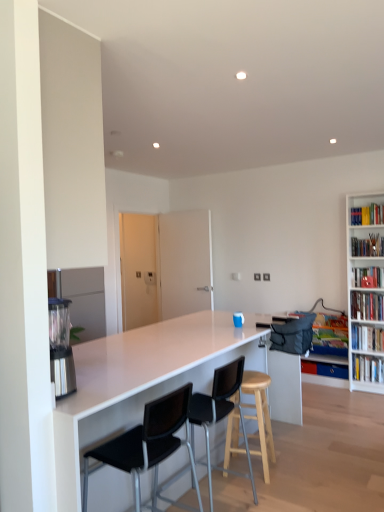
Question: Is white matte bookshelf at right, acting as the 4th book starting from the top, located within hardcover book at upper right, which is the 1th book in top-to-bottom order?

Choices:
 (A) yes
 (B) no

Answer: (B)

Question: Can you confirm if hardcover book at upper right, which is the 1th book in top-to-bottom order, is thinner than white matte bookshelf at right, acting as the 4th book starting from the top?

Choices:
 (A) no
 (B) yes

Answer: (B)

Question: Does hardcover book at upper right, the 7th book in the bottom-to-top sequence, turn towards white matte bookshelf at right, acting as the 4th book starting from the top?

Choices:
 (A) yes
 (B) no

Answer: (B)

Question: Is hardcover book at upper right, which is the 1th book in top-to-bottom order, closer to the viewer compared to white matte bookshelf at right, acting as the 4th book starting from the top?

Choices:
 (A) no
 (B) yes

Answer: (A)

Question: Can you confirm if hardcover book at upper right, which is the 1th book in top-to-bottom order, is taller than white matte bookshelf at right, which appears as the 4th book when ordered from the bottom?

Choices:
 (A) no
 (B) yes

Answer: (A)

Question: From a real-world perspective, is hardcover book at upper right, the 7th book in the bottom-to-top sequence, under white matte bookshelf at right, acting as the 4th book starting from the top?

Choices:
 (A) yes
 (B) no

Answer: (B)

Question: Is stainless steel blender at left bigger than white glossy countertop at center?

Choices:
 (A) no
 (B) yes

Answer: (A)

Question: Would you say stainless steel blender at left is outside white glossy countertop at center?

Choices:
 (A) no
 (B) yes

Answer: (B)

Question: Could white glossy countertop at center be considered to be inside stainless steel blender at left?

Choices:
 (A) no
 (B) yes

Answer: (A)

Question: Considering the relative positions of stainless steel blender at left and white glossy countertop at center in the image provided, is stainless steel blender at left to the left of white glossy countertop at center from the viewer's perspective?

Choices:
 (A) no
 (B) yes

Answer: (B)

Question: Is stainless steel blender at left positioned with its back to white glossy countertop at center?

Choices:
 (A) no
 (B) yes

Answer: (A)

Question: Is stainless steel blender at left shorter than white glossy countertop at center?

Choices:
 (A) yes
 (B) no

Answer: (A)

Question: Is black plastic chair at center, marked as the second chair in a back-to-front arrangement, smaller than stainless steel blender at left?

Choices:
 (A) no
 (B) yes

Answer: (A)